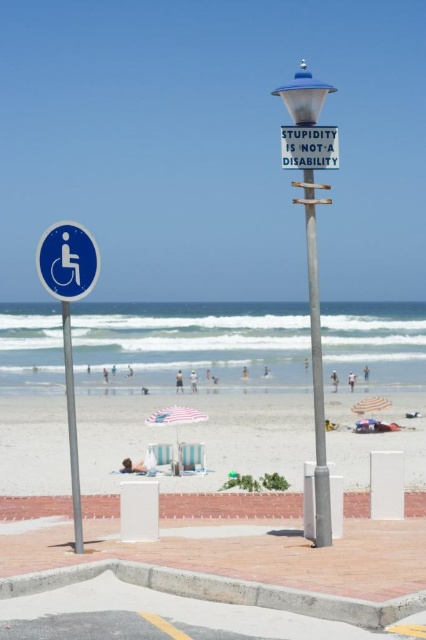
Question: Which object appears farthest from the camera in this image?

Choices:
 (A) beach umbrella at center
 (B) blue plastic wheelchair sign at left
 (C) white plastic sign at upper center
 (D) silver metallic pole at center

Answer: (A)

Question: Does blue plastic wheelchair sign at left appear under silver metallic pole at left?

Choices:
 (A) no
 (B) yes

Answer: (A)

Question: Which point is closer to the camera taking this photo?

Choices:
 (A) (322, 164)
 (B) (74, 445)
 (C) (17, 403)

Answer: (B)

Question: Is blue plastic wheelchair sign at left behind silver metallic pole at left?

Choices:
 (A) no
 (B) yes

Answer: (B)

Question: Which point is farther from the camera taking this photo?

Choices:
 (A) (62, 291)
 (B) (126, 436)
 (C) (305, 160)
 (D) (313, 358)

Answer: (B)

Question: Is beach umbrella at center bigger than blue plastic wheelchair sign at left?

Choices:
 (A) yes
 (B) no

Answer: (A)